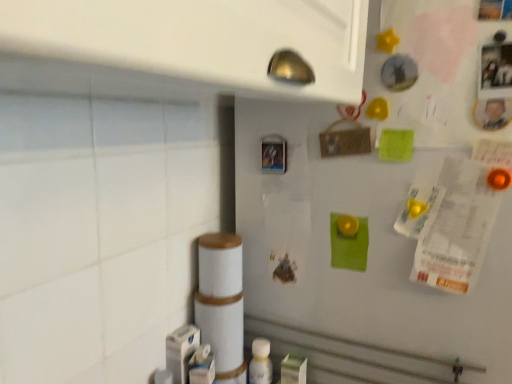
What is the approximate width of white matte refrigerator at upper right?

23.43 inches.

Locate an element on the screen. The height and width of the screenshot is (384, 512). white matte refrigerator at upper right is located at coordinates (389, 208).

Image resolution: width=512 pixels, height=384 pixels. What do you see at coordinates (260, 362) in the screenshot?
I see `white plastic bottle at lower center` at bounding box center [260, 362].

Image resolution: width=512 pixels, height=384 pixels. I want to click on white matte refrigerator at upper right, so click(x=389, y=208).

In the image, there is a metallic plastic button at center. Identify the location of bottle below it (from the image's perspective). (260, 362).

How far apart are white plastic bottle at lower center and metallic plastic button at center?

white plastic bottle at lower center is 14.69 inches away from metallic plastic button at center.

Does white plastic bottle at lower center have a greater height compared to metallic plastic button at center?

Indeed, white plastic bottle at lower center has a greater height compared to metallic plastic button at center.

Can metallic plastic button at center be found inside white plastic bottle at lower center?

No, metallic plastic button at center is not surrounded by white plastic bottle at lower center.

From the image's perspective, is white matte refrigerator at upper right over metallic plastic button at center?

No, from the image's perspective, white matte refrigerator at upper right is not above metallic plastic button at center.

Between point (380, 93) and point (282, 148), which one is positioned behind?

The point (282, 148) is farther.

Is white matte refrigerator at upper right positioned in front of metallic plastic button at center?

Yes, it is in front of metallic plastic button at center.

Between point (321, 165) and point (265, 377), which one is positioned behind?

Positioned behind is point (265, 377).

From a real-world perspective, relative to white plastic bottle at lower center, is white matte refrigerator at upper right vertically above or below?

In terms of real-world spatial position, white matte refrigerator at upper right is above white plastic bottle at lower center.

The width and height of the screenshot is (512, 384). Identify the location of bottle that is below the white matte refrigerator at upper right (from the image's perspective). (260, 362).

Is white matte refrigerator at upper right directly adjacent to white plastic bottle at lower center?

white matte refrigerator at upper right and white plastic bottle at lower center are not in contact.

From a real-world perspective, is metallic plastic button at center located higher than white matte refrigerator at upper right?

Correct, in the physical world, metallic plastic button at center is higher than white matte refrigerator at upper right.

Measure the distance between metallic plastic button at center and white matte refrigerator at upper right.

metallic plastic button at center is 24.28 centimeters from white matte refrigerator at upper right.

In terms of size, does metallic plastic button at center appear bigger or smaller than white matte refrigerator at upper right?

In the image, metallic plastic button at center appears to be smaller than white matte refrigerator at upper right.

Is metallic plastic button at center aimed at white matte refrigerator at upper right?

No, metallic plastic button at center is not facing towards white matte refrigerator at upper right.

Considering the relative positions of white plastic bottle at lower center and white matte refrigerator at upper right in the image provided, is white plastic bottle at lower center to the right of white matte refrigerator at upper right from the viewer's perspective?

No, white plastic bottle at lower center is not to the right of white matte refrigerator at upper right.

From a real-world perspective, does white plastic bottle at lower center stand above white matte refrigerator at upper right?

No, from a real-world perspective, white plastic bottle at lower center is not on top of white matte refrigerator at upper right.

Does white plastic bottle at lower center turn towards white matte refrigerator at upper right?

No, white plastic bottle at lower center does not turn towards white matte refrigerator at upper right.

Is metallic plastic button at center smaller than white plastic bottle at lower center?

Yes.

Could you tell me if metallic plastic button at center is facing white plastic bottle at lower center?

No, metallic plastic button at center is not oriented towards white plastic bottle at lower center.

Considering the positions of objects metallic plastic button at center and white plastic bottle at lower center in the image provided, who is more to the right, metallic plastic button at center or white plastic bottle at lower center?

metallic plastic button at center.

Find the location of `button above the white plastic bottle at lower center (from a real-world perspective)`. button above the white plastic bottle at lower center (from a real-world perspective) is located at coordinates (274, 154).

The height and width of the screenshot is (384, 512). In order to click on button in front of the white plastic bottle at lower center in this screenshot , I will do `click(274, 154)`.

The image size is (512, 384). I want to click on fridge located on the right of metallic plastic button at center, so click(389, 208).

Which object lies nearer to the anchor point metallic plastic button at center, white plastic bottle at lower center or white matte refrigerator at upper right?

white matte refrigerator at upper right.

When comparing their distances from metallic plastic button at center, does white matte refrigerator at upper right or white plastic bottle at lower center seem further?

The object further to metallic plastic button at center is white plastic bottle at lower center.

Based on their spatial positions, is white matte refrigerator at upper right or metallic plastic button at center further from white plastic bottle at lower center?

metallic plastic button at center.

Which object lies nearer to the anchor point white matte refrigerator at upper right, metallic plastic button at center or white plastic bottle at lower center?

metallic plastic button at center is closer to white matte refrigerator at upper right.

Considering their positions, is white plastic bottle at lower center positioned further to white matte refrigerator at upper right than metallic plastic button at center?

white plastic bottle at lower center is positioned further to the anchor white matte refrigerator at upper right.

Based on the photo, considering their positions, is metallic plastic button at center positioned further to white plastic bottle at lower center than white matte refrigerator at upper right?

The object further to white plastic bottle at lower center is metallic plastic button at center.

Find the location of a particular element. fridge between metallic plastic button at center and white plastic bottle at lower center in the vertical direction is located at coordinates (389, 208).